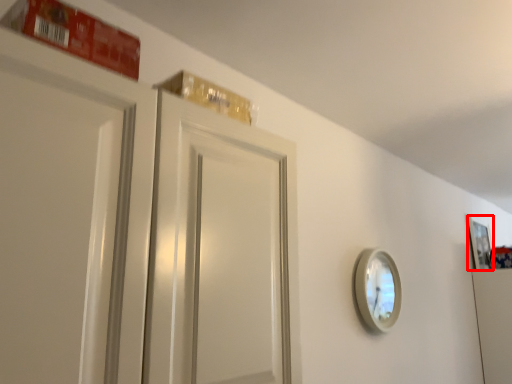
Question: Observing the image, what is the correct spatial positioning of picture frame (annotated by the red box) in reference to mirror?

Choices:
 (A) right
 (B) left

Answer: (A)